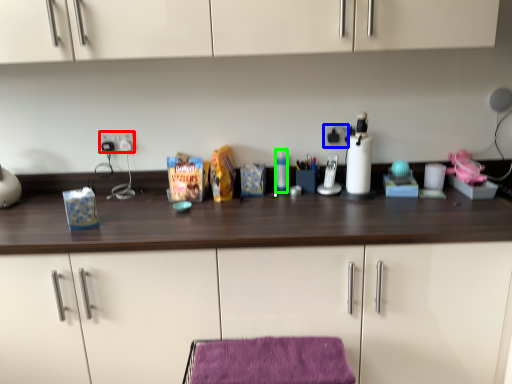
Question: Which object is the farthest from electric outlet (highlighted by a red box)? Choose among these: electric outlet (highlighted by a blue box) or bottle (highlighted by a green box).

Choices:
 (A) electric outlet
 (B) bottle

Answer: (A)